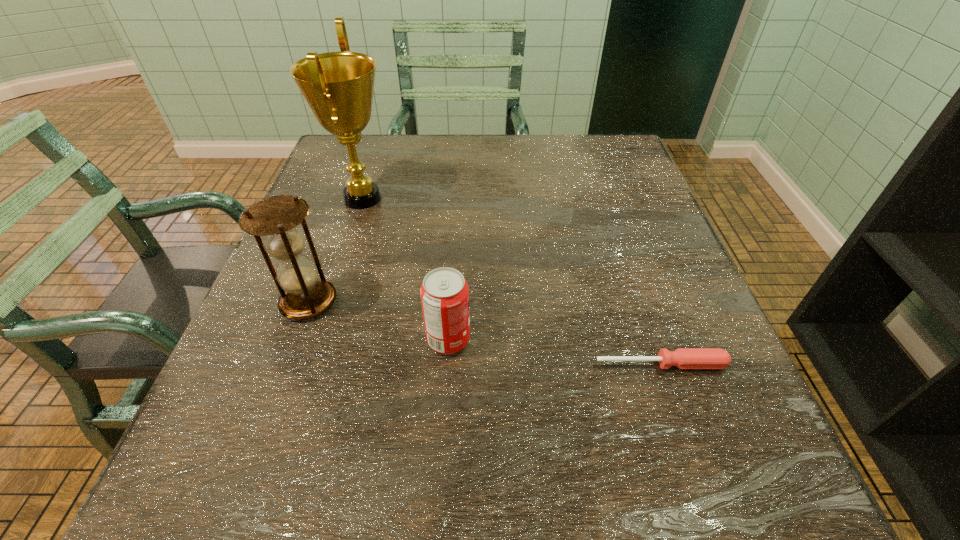
Locate an element on the screen. The width and height of the screenshot is (960, 540). vacant space at the far left corner of the desktop is located at coordinates pos(360,140).

This screenshot has width=960, height=540. What are the coordinates of `free location at the near left corner of the desktop` in the screenshot? It's located at (155, 516).

Locate an element on the screen. free spot at the near right corner of the desktop is located at coordinates (695, 503).

Identify the location of unoccupied position between the rightmost object and the second object from right to left. (555, 352).

Where is `vacant area that lies between the screwdriver and the third object from left to right`? vacant area that lies between the screwdriver and the third object from left to right is located at coordinates (555, 352).

Image resolution: width=960 pixels, height=540 pixels. What are the coordinates of `vacant area that lies between the hourglass and the screwdriver` in the screenshot? It's located at (485, 333).

Locate an element on the screen. This screenshot has width=960, height=540. free space that is in between the second tallest object and the award is located at coordinates (336, 250).

Locate an element on the screen. vacant area that lies between the shortest object and the tallest object is located at coordinates (512, 281).

Locate an element on the screen. Image resolution: width=960 pixels, height=540 pixels. vacant area between the screwdriver and the farthest object is located at coordinates (512, 281).

The height and width of the screenshot is (540, 960). I want to click on free space between the third tallest object and the screwdriver, so click(555, 352).